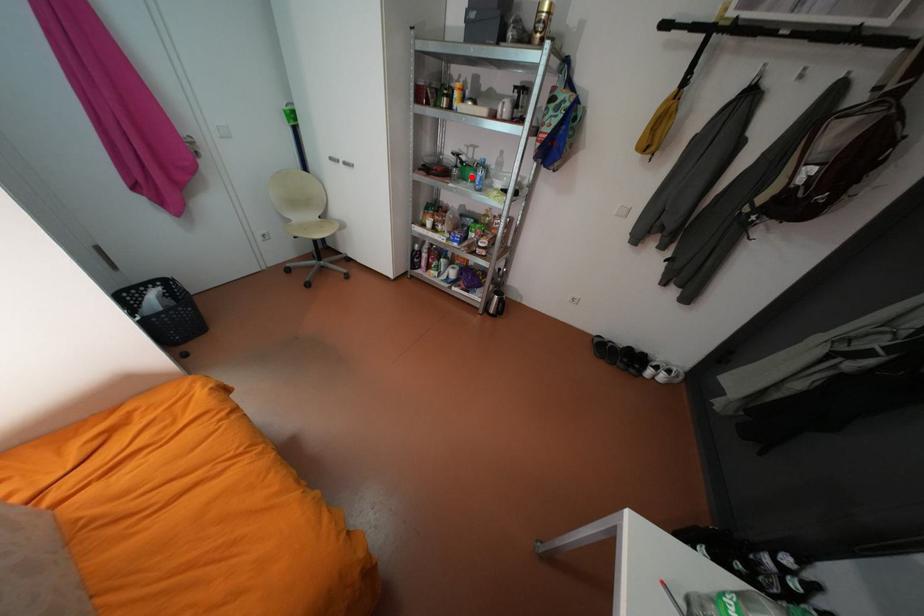
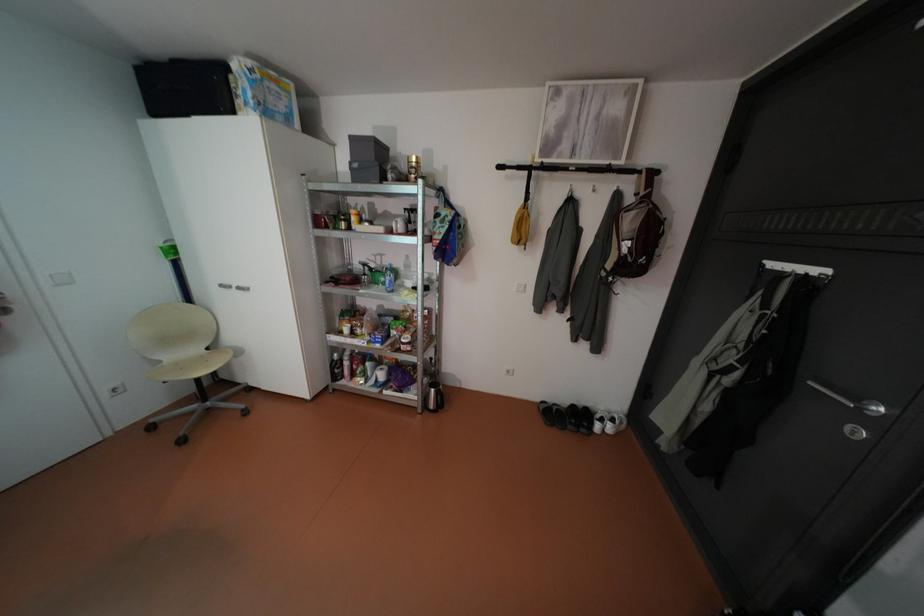
Question: I am providing you with two images of the same scene from different viewpoints. Given a red point in image1, look at the same physical point in image2. Is it:

Choices:
 (A) Closer to the viewpoint
 (B) Farther from the viewpoint

Answer: (B)